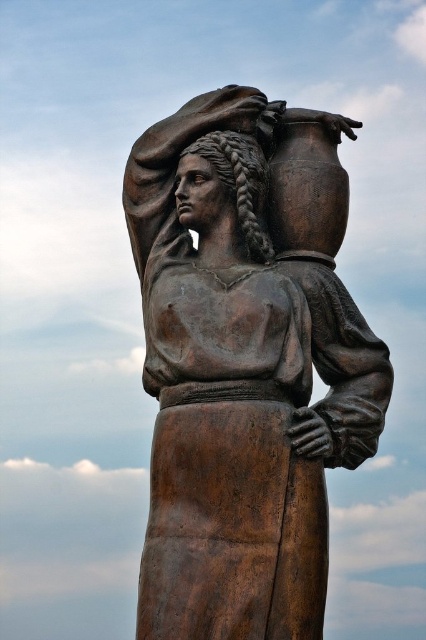
Who is more distant from viewer, (235, 150) or (253, 225)?

The point (235, 150) is behind.

Which of these two, bronze head at center or dark brown textured hair at upper center, stands shorter?

bronze head at center is shorter.

What are the coordinates of `bronze head at center` in the screenshot? It's located at (238, 180).

Between point (282, 340) and point (227, 132), which one is positioned behind?

Positioned behind is point (227, 132).

Is bronze statue at center below bronze head at center?

Indeed, bronze statue at center is positioned under bronze head at center.

Between point (339, 426) and point (249, 156), which one is positioned behind?

Positioned behind is point (249, 156).

This screenshot has width=426, height=640. Find the location of `bronze statue at center`. bronze statue at center is located at coordinates (241, 378).

Does point (158, 518) lie in front of point (258, 236)?

That is True.

Between bronze statue at center and dark brown textured hair at upper center, which one has more height?

With more height is bronze statue at center.

Does point (155, 460) come in front of point (242, 205)?

Yes, it is in front of point (242, 205).

Where is `bronze statue at center`? bronze statue at center is located at coordinates (241, 378).